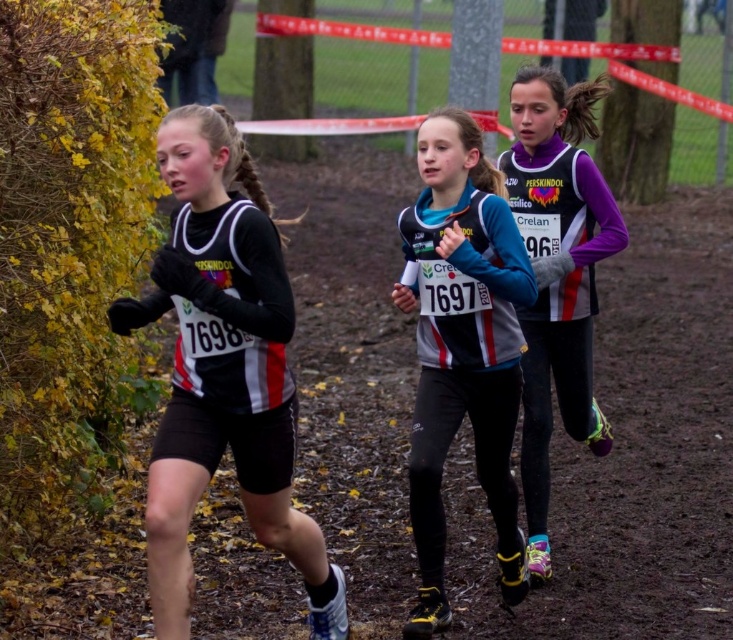
You are a photographer positioned at the starting line of the cross country race. You want to take a photo that includes both the point at location (95, 588) and the point at (523, 88). Which point should you focus on first to ensure both are in clear view?

You should focus on point (95, 588) first because it is closer to the camera than point (523, 88), ensuring both will be in focus when using a shallow depth of field.

You are a runner in the cross country race and you want to stay on the dirt track. Where should you position yourself relative to the three runners? Please provide coordinates in the format of a point like point (x=630, y=452).

The brown dirt track at center is represented by point (x=630, y=452), so you should position yourself at point (x=630, y=452) to stay on the dirt track.

You are a runner in a cross country race and need to stay on the race path. Where is the brown dirt track at center located?

The brown dirt track at center is located at point (630, 452).